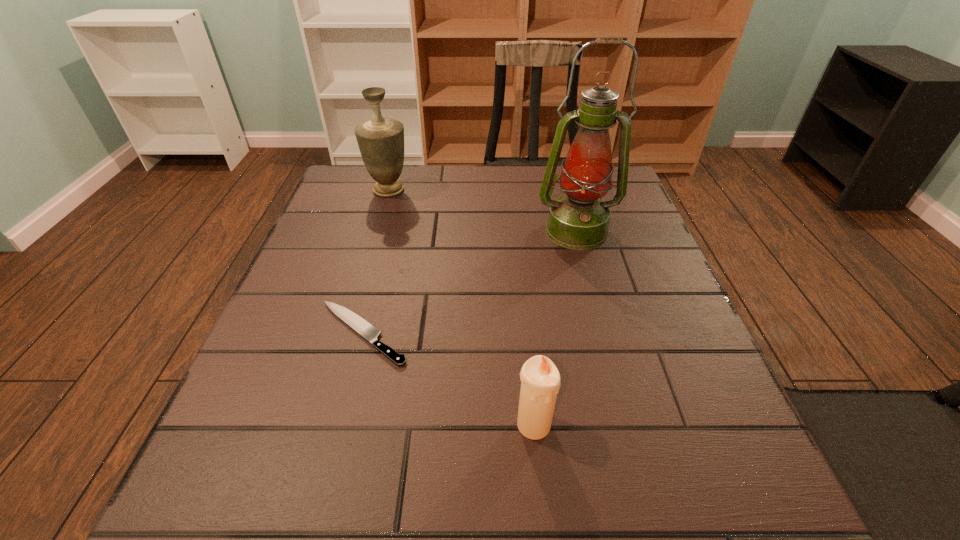
What are the coordinates of `vacant space at the right edge of the desktop` in the screenshot? It's located at (708, 432).

Locate an element on the screen. The height and width of the screenshot is (540, 960). free space at the far left corner of the desktop is located at coordinates (358, 181).

Identify the location of vacant area at the near left corner. (204, 513).

Find the location of a particular element. This screenshot has width=960, height=540. free point between the tallest object and the candle is located at coordinates (555, 327).

You are a GUI agent. You are given a task and a screenshot of the screen. Output one action in this format:
    pyautogui.click(x=<x>, y=<y>)
    Task: Click on the free space between the third object from left to right and the steak knife
    
    Given the screenshot: What is the action you would take?
    click(x=448, y=379)

This screenshot has width=960, height=540. I want to click on vacant space that is in between the steak knife and the rightmost object, so click(x=469, y=282).

I want to click on vacant space that's between the farthest object and the third object from left to right, so click(461, 307).

The image size is (960, 540). I want to click on blank region between the farthest object and the tallest object, so click(x=483, y=211).

At what (x,y) coordinates should I click in order to perform the action: click on free space between the third object from left to right and the rightmost object. Please return your answer as a coordinate pair (x, y). Image resolution: width=960 pixels, height=540 pixels. Looking at the image, I should click on (555, 327).

Locate an element on the screen. vacant area that lies between the second nearest object and the tallest object is located at coordinates (469, 282).